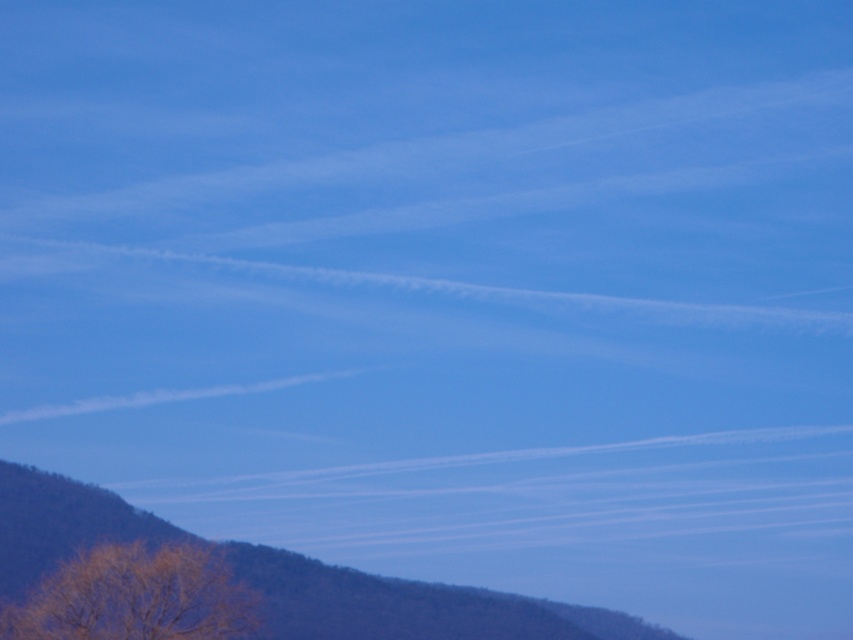
Question: Can you confirm if brown textured mountain at lower left is positioned above brown textured tree at lower left?

Choices:
 (A) no
 (B) yes

Answer: (A)

Question: Which point is closer to the camera?

Choices:
 (A) (309, 580)
 (B) (90, 634)

Answer: (B)

Question: Is brown textured mountain at lower left positioned behind brown textured tree at lower left?

Choices:
 (A) yes
 (B) no

Answer: (A)

Question: Can you confirm if brown textured mountain at lower left is smaller than brown textured tree at lower left?

Choices:
 (A) no
 (B) yes

Answer: (A)

Question: Among these objects, which one is nearest to the camera?

Choices:
 (A) brown textured tree at lower left
 (B) brown textured mountain at lower left

Answer: (A)